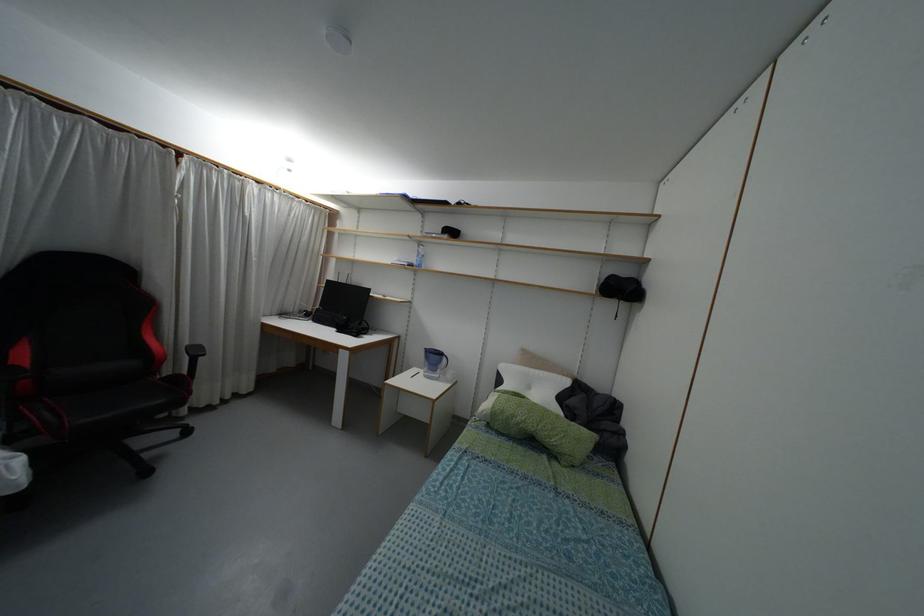
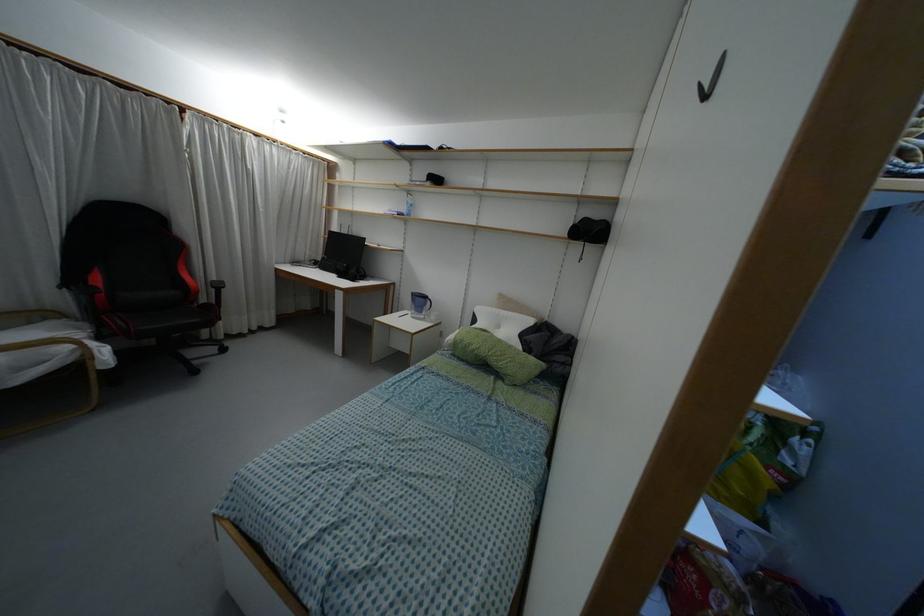
The point at (195, 352) is marked in the first image. Where is the corresponding point in the second image?

(217, 286)